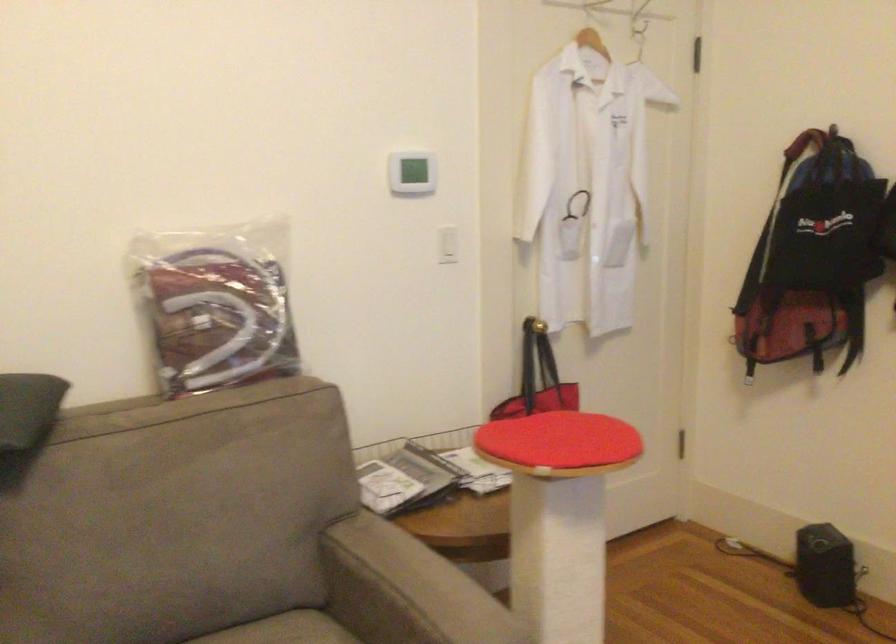
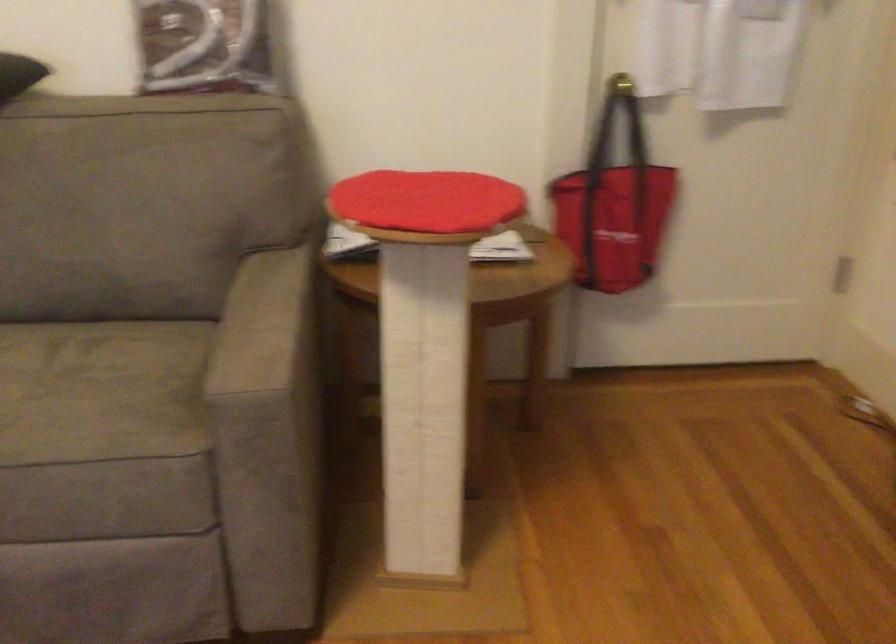
The images are taken continuously from a first-person perspective. In which direction is your viewpoint rotating?

The camera rotated toward left-down.